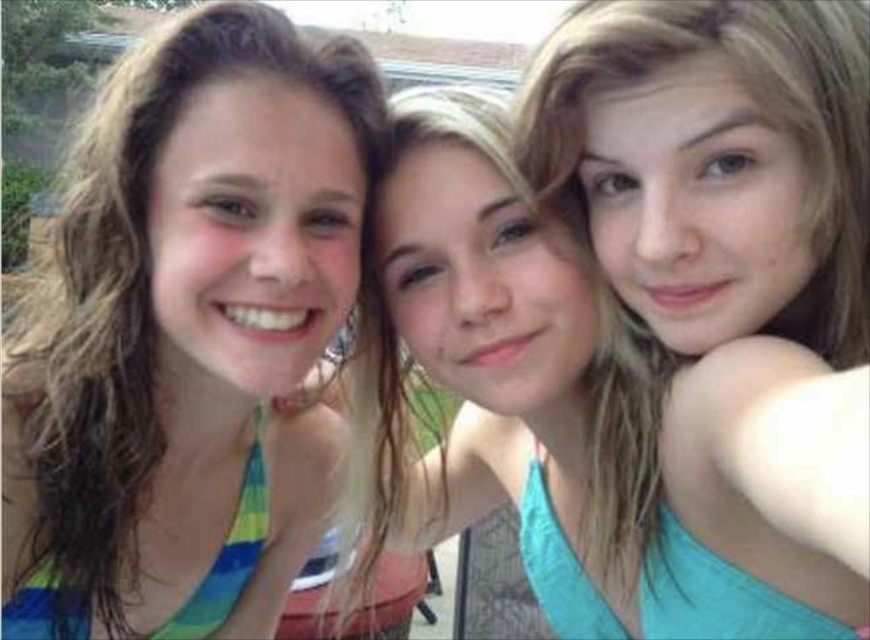
Identify the location of blue striped swimsuit at left. The height and width of the screenshot is (640, 870). (186, 333).

Is blue striped swimsuit at left smaller than blonde hair at upper right?

Actually, blue striped swimsuit at left might be larger than blonde hair at upper right.

Between point (206, 636) and point (840, 72), which one is positioned behind?

The point (206, 636) is behind.

Where is `blue striped swimsuit at left`? Image resolution: width=870 pixels, height=640 pixels. blue striped swimsuit at left is located at coordinates (186, 333).

Does matte teal tank top at center come behind blonde hair at upper right?

Yes, it is.

Is point (397, 124) positioned in front of point (862, 266)?

No, (397, 124) is further to viewer.

Where is `matte teal tank top at center`? This screenshot has height=640, width=870. matte teal tank top at center is located at coordinates (474, 326).

Can you confirm if blue striped swimsuit at left is positioned to the left of matte teal tank top at center?

Indeed, blue striped swimsuit at left is positioned on the left side of matte teal tank top at center.

Is blue striped swimsuit at left smaller than matte teal tank top at center?

Yes.

Image resolution: width=870 pixels, height=640 pixels. I want to click on blue striped swimsuit at left, so point(186,333).